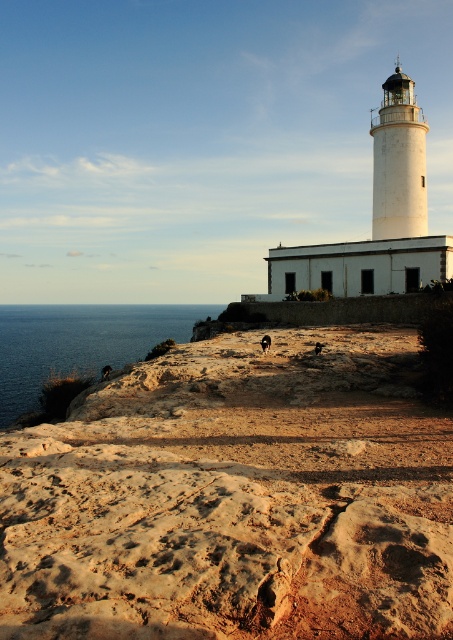
You are standing on the cliff near the lighthouse and want to walk down to the blue water at lower left. Which direction should you head to first, towards the rustic stone beach at center or away from it?

You should head towards the rustic stone beach at center first because it is in front of the blue water at lower left, meaning it is closer to your destination.